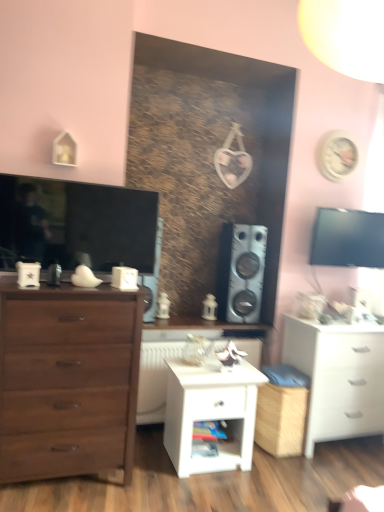
What do you see at coordinates (209, 437) in the screenshot? I see `wooden shelf at center` at bounding box center [209, 437].

What do you see at coordinates (241, 272) in the screenshot? The height and width of the screenshot is (512, 384). I see `metallic silver speaker at center-right` at bounding box center [241, 272].

In order to click on white glossy nightstand at center in this screenshot , I will do `click(211, 414)`.

The width and height of the screenshot is (384, 512). Identify the location of matte brown chest of drawers at left, acting as the second chest of drawers starting from the right. (67, 380).

Where is `white plastic radiator at center`? The height and width of the screenshot is (512, 384). white plastic radiator at center is located at coordinates (154, 379).

This screenshot has width=384, height=512. What do you see at coordinates (338, 377) in the screenshot? I see `white matte chest of drawers at lower right, which ranks as the second chest of drawers in left-to-right order` at bounding box center [338, 377].

The image size is (384, 512). What do you see at coordinates (82, 223) in the screenshot?
I see `matte black television at left` at bounding box center [82, 223].

Locate an element on the screen. This screenshot has width=384, height=512. wooden shelf at center is located at coordinates (209, 437).

Does metallic silver speaker at center-right appear on the right side of white matte chest of drawers at lower right, acting as the first chest of drawers starting from the back?

Incorrect, metallic silver speaker at center-right is not on the right side of white matte chest of drawers at lower right, acting as the first chest of drawers starting from the back.

From the picture: From the image's perspective, which object appears higher, metallic silver speaker at center-right or white matte chest of drawers at lower right, which ranks as the second chest of drawers in left-to-right order?

metallic silver speaker at center-right appears higher in the image.

Between metallic silver speaker at center-right and white matte chest of drawers at lower right, which ranks as the second chest of drawers in front-to-back order, which one has less height?

metallic silver speaker at center-right.

From a real-world perspective, is metallic silver speaker at center-right over white matte chest of drawers at lower right, which ranks as the second chest of drawers in left-to-right order?

Correct, in the physical world, metallic silver speaker at center-right is higher than white matte chest of drawers at lower right, which ranks as the second chest of drawers in left-to-right order.

Is wooden shelf at center bigger than white matte chest of drawers at lower right, which ranks as the second chest of drawers in front-to-back order?

Actually, wooden shelf at center might be smaller than white matte chest of drawers at lower right, which ranks as the second chest of drawers in front-to-back order.

How much distance is there between wooden shelf at center and white matte chest of drawers at lower right, the 1th chest of drawers when ordered from right to left?

wooden shelf at center is 91.50 centimeters away from white matte chest of drawers at lower right, the 1th chest of drawers when ordered from right to left.

Which object is wider, wooden shelf at center or white matte chest of drawers at lower right, which ranks as the second chest of drawers in left-to-right order?

white matte chest of drawers at lower right, which ranks as the second chest of drawers in left-to-right order.

Is point (201, 439) closer or farther from the camera than point (308, 443)?

Clearly, point (201, 439) is closer to the camera than point (308, 443).

Considering the positions of objects white matte chest of drawers at lower right, which ranks as the second chest of drawers in front-to-back order, and white plastic radiator at center in the image provided, who is more to the left, white matte chest of drawers at lower right, which ranks as the second chest of drawers in front-to-back order, or white plastic radiator at center?

white plastic radiator at center.

From a real-world perspective, does white matte chest of drawers at lower right, which ranks as the second chest of drawers in front-to-back order, sit lower than white plastic radiator at center?

No, from a real-world perspective, white matte chest of drawers at lower right, which ranks as the second chest of drawers in front-to-back order, is not beneath white plastic radiator at center.

Is white matte chest of drawers at lower right, the 1th chest of drawers when ordered from right to left, in front of or behind white plastic radiator at center in the image?

Clearly, white matte chest of drawers at lower right, the 1th chest of drawers when ordered from right to left, is in front of white plastic radiator at center.

How many degrees apart are the facing directions of white matte chest of drawers at lower right, which ranks as the second chest of drawers in left-to-right order, and white plastic radiator at center?

The angular difference between white matte chest of drawers at lower right, which ranks as the second chest of drawers in left-to-right order, and white plastic radiator at center is 1.81 degrees.

Between white glossy nightstand at center and white matte chest of drawers at lower right, acting as the first chest of drawers starting from the back, which one appears on the left side from the viewer's perspective?

white glossy nightstand at center is more to the left.

Looking at this image, from the image's perspective, which object appears higher, white glossy nightstand at center or white matte chest of drawers at lower right, which ranks as the second chest of drawers in front-to-back order?

white matte chest of drawers at lower right, which ranks as the second chest of drawers in front-to-back order, appears higher in the image.

The image size is (384, 512). Find the location of `nightstand below the white matte chest of drawers at lower right, which ranks as the second chest of drawers in left-to-right order (from the image's perspective)`. nightstand below the white matte chest of drawers at lower right, which ranks as the second chest of drawers in left-to-right order (from the image's perspective) is located at coordinates (211, 414).

Does matte brown chest of drawers at left, the first chest of drawers positioned from the left, have a greater height compared to black glossy tv at upper right?

Yes.

Is matte brown chest of drawers at left, which ranks as the first chest of drawers in front-to-back order, in contact with black glossy tv at upper right?

matte brown chest of drawers at left, which ranks as the first chest of drawers in front-to-back order, and black glossy tv at upper right are not in contact.

How many degrees apart are the facing directions of matte brown chest of drawers at left, the first chest of drawers positioned from the left, and black glossy tv at upper right?

matte brown chest of drawers at left, the first chest of drawers positioned from the left, and black glossy tv at upper right are facing 3.37 degrees away from each other.

Is matte brown chest of drawers at left, the first chest of drawers positioned from the left, oriented away from black glossy tv at upper right?

That's not correct — matte brown chest of drawers at left, the first chest of drawers positioned from the left, is not looking away from black glossy tv at upper right.

Which is closer to the camera, (161, 393) or (227, 237)?

Point (161, 393) is closer to the camera than point (227, 237).

Would you say metallic silver speaker at center-right is part of white plastic radiator at center's contents?

No, white plastic radiator at center does not contain metallic silver speaker at center-right.

Is black glossy tv at upper right to the right of white glossy nightstand at center from the viewer's perspective?

Indeed, black glossy tv at upper right is positioned on the right side of white glossy nightstand at center.

Is black glossy tv at upper right directly adjacent to white glossy nightstand at center?

black glossy tv at upper right and white glossy nightstand at center are not in contact.

Who is bigger, black glossy tv at upper right or white glossy nightstand at center?

Bigger between the two is white glossy nightstand at center.

From a real-world perspective, between black glossy tv at upper right and white glossy nightstand at center, who is vertically higher?

In real-world perspective, black glossy tv at upper right is above.

The image size is (384, 512). What are the coordinates of `speaker that is on the left side of white matte chest of drawers at lower right, the 1th chest of drawers when ordered from right to left` in the screenshot? It's located at (241, 272).

Identify the location of shelf that appears below the white matte chest of drawers at lower right, which ranks as the second chest of drawers in left-to-right order (from a real-world perspective). (209, 437).

Which object lies nearer to the anchor point white matte chest of drawers at lower right, which ranks as the second chest of drawers in front-to-back order, matte black television at left or wooden shelf at center?

The object closer to white matte chest of drawers at lower right, which ranks as the second chest of drawers in front-to-back order, is wooden shelf at center.

Based on their spatial positions, is white matte chest of drawers at lower right, the 1th chest of drawers when ordered from right to left, or black glossy tv at upper right closer to matte black television at left?

black glossy tv at upper right lies closer to matte black television at left than the other object.

Which object lies further to the anchor point white plastic radiator at center, metallic silver speaker at center-right or matte brown chest of drawers at left, which ranks as the 2th chest of drawers in back-to-front order?

matte brown chest of drawers at left, which ranks as the 2th chest of drawers in back-to-front order, lies further to white plastic radiator at center than the other object.

From the image, which object appears to be nearer to white matte chest of drawers at lower right, the 1th chest of drawers when ordered from right to left, wooden shelf at center or metallic silver speaker at center-right?

metallic silver speaker at center-right is positioned closer to the anchor white matte chest of drawers at lower right, the 1th chest of drawers when ordered from right to left.

Estimate the real-world distances between objects in this image. Which object is further from wooden shelf at center, matte brown chest of drawers at left, which ranks as the first chest of drawers in front-to-back order, or metallic silver speaker at center-right?

Among the two, metallic silver speaker at center-right is located further to wooden shelf at center.

Estimate the real-world distances between objects in this image. Which object is closer to white glossy nightstand at center, matte brown chest of drawers at left, acting as the second chest of drawers starting from the right, or metallic silver speaker at center-right?

Among the two, matte brown chest of drawers at left, acting as the second chest of drawers starting from the right, is located nearer to white glossy nightstand at center.

From the image, which object appears to be nearer to matte black television at left, white plastic radiator at center or black glossy tv at upper right?

white plastic radiator at center lies closer to matte black television at left than the other object.

Based on their spatial positions, is white matte chest of drawers at lower right, which ranks as the second chest of drawers in front-to-back order, or black glossy tv at upper right further from metallic silver speaker at center-right?

white matte chest of drawers at lower right, which ranks as the second chest of drawers in front-to-back order.

Find the location of `speaker between white plastic radiator at center and white matte chest of drawers at lower right, which ranks as the second chest of drawers in front-to-back order`. speaker between white plastic radiator at center and white matte chest of drawers at lower right, which ranks as the second chest of drawers in front-to-back order is located at coordinates 241,272.

In order to click on nightstand located between matte brown chest of drawers at left, which ranks as the 2th chest of drawers in back-to-front order, and metallic silver speaker at center-right in the depth direction in this screenshot , I will do `click(211, 414)`.

The image size is (384, 512). Identify the location of shelf between matte brown chest of drawers at left, which ranks as the first chest of drawers in front-to-back order, and white matte chest of drawers at lower right, which ranks as the second chest of drawers in left-to-right order. (209, 437).

Find the location of a particular element. nightstand situated between matte black television at left and white matte chest of drawers at lower right, acting as the first chest of drawers starting from the back, from left to right is located at coordinates (211, 414).